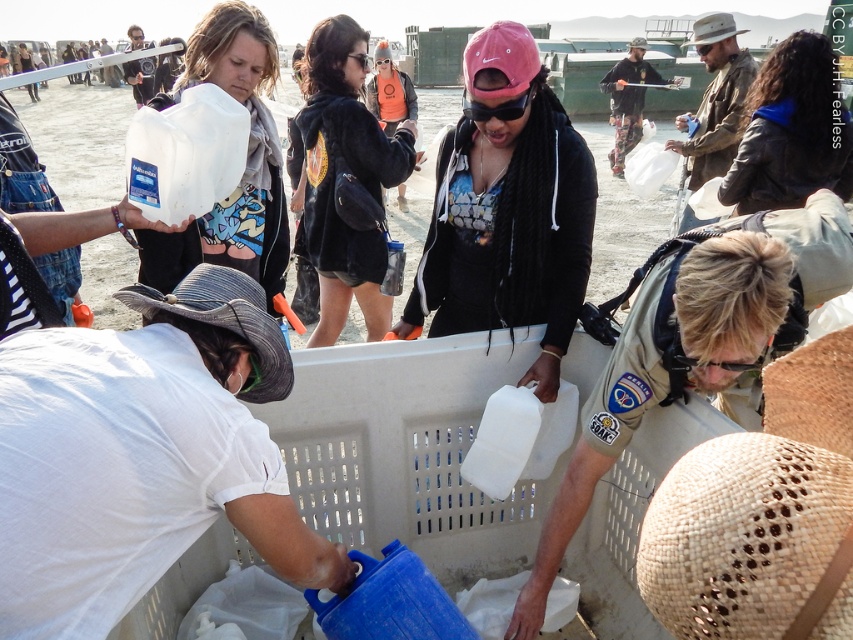
You are a participant at this event and need to choose between the matte white jug at center and the blue leather jacket at upper right to carry water. Which object can hold more water based on their sizes?

The matte white jug at center has a greater height compared to the blue leather jacket at upper right, so it can hold more water.

You are organizing a water distribution event and need to fit both the matte white jug at center and the black fuzzy jacket at center into a narrow storage compartment. Based on their sizes, which item should you place first to ensure both fit?

The matte white jug at center is thinner than the black fuzzy jacket at center, so you should place the matte white jug at center first to allow the thicker black fuzzy jacket at center to fit into the remaining space.